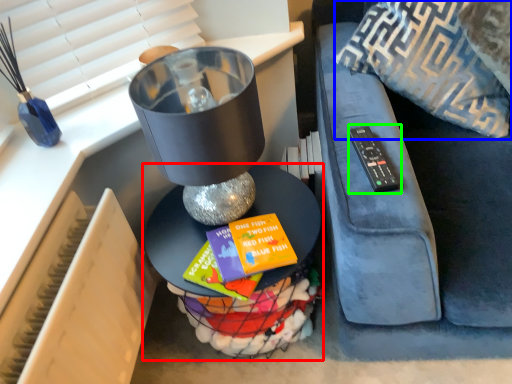
Question: Which object is positioned closest to table (highlighted by a red box)? Select from throw pillow (highlighted by a blue box) and remote (highlighted by a green box).

Choices:
 (A) throw pillow
 (B) remote

Answer: (B)